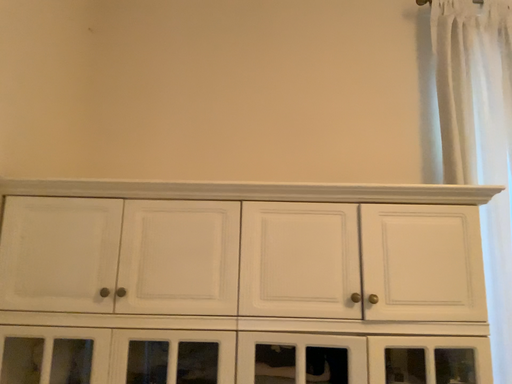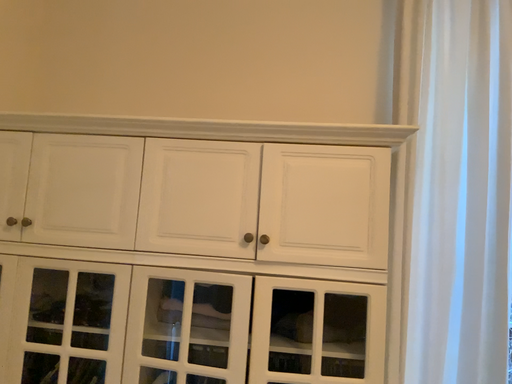
Question: Which way did the camera rotate in the video?

Choices:
 (A) rotated left
 (B) rotated right

Answer: (A)